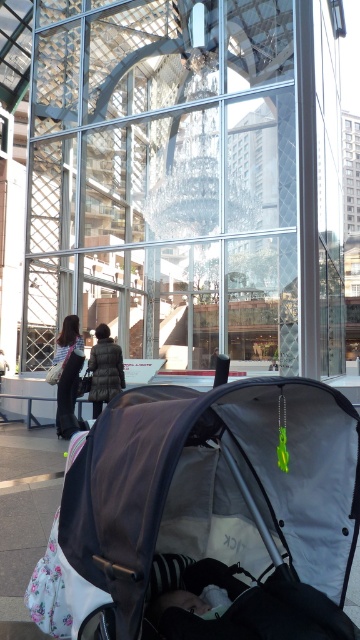
Who is lower down, dark gray fabric baby carriage at lower left or striped fabric dress at center?

→ dark gray fabric baby carriage at lower left is below.

Does point (249, 544) lie behind point (56, 356)?

That is False.

Does point (304, 504) come in front of point (77, 346)?

Yes, point (304, 504) is closer to viewer.

At what (x,y) coordinates should I click in order to perform the action: click on dark gray fabric baby carriage at lower left. Please return your answer as a coordinate pair (x, y). Image resolution: width=360 pixels, height=640 pixels. Looking at the image, I should click on (209, 497).

How much distance is there between transparent glass mall at center and dark gray down jacket at center?

transparent glass mall at center is 14.51 meters from dark gray down jacket at center.

I want to click on transparent glass mall at center, so click(186, 186).

Who is shorter, transparent glass mall at center or striped fabric dress at center?

With less height is striped fabric dress at center.

Locate an element on the screen. Image resolution: width=360 pixels, height=640 pixels. transparent glass mall at center is located at coordinates [186, 186].